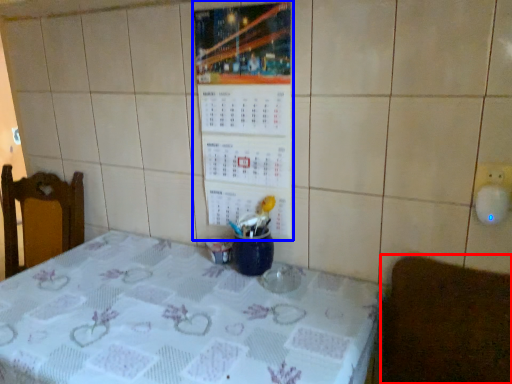
Question: Which point is further to the camera, furniture (highlighted by a red box) or bulletin board (highlighted by a blue box)?

Choices:
 (A) furniture
 (B) bulletin board

Answer: (B)